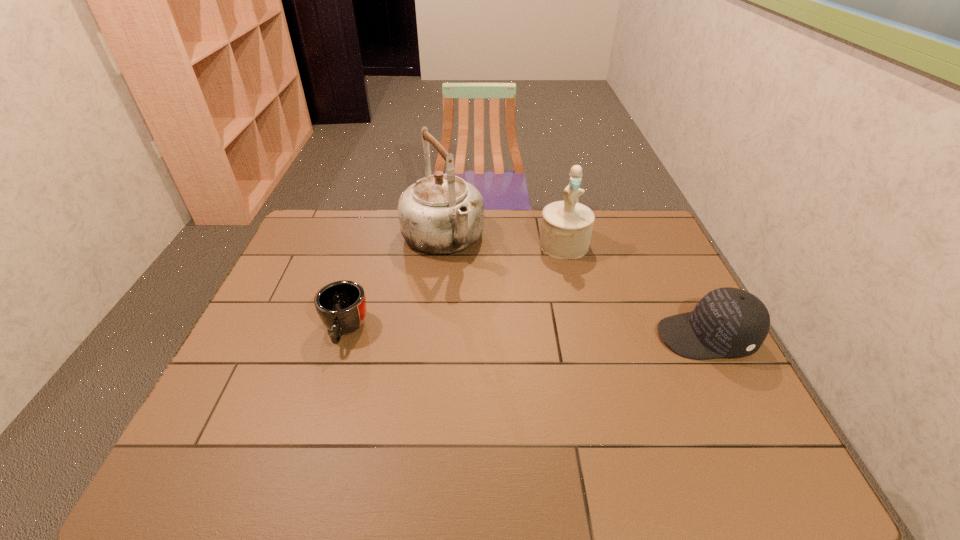
At what (x,y) coordinates should I click in order to perform the action: click on free spot located at the front of the baseball cap where the brim is located. Please return your answer as a coordinate pair (x, y). This screenshot has height=540, width=960. Looking at the image, I should click on tap(595, 337).

What are the coordinates of `vacant space positioned 0.150m at the front of the baseball cap where the brim is located` in the screenshot? It's located at (603, 337).

The height and width of the screenshot is (540, 960). I want to click on free space located at the beak of the third object from left to right, so click(565, 282).

Where is `free space located at the beak of the third object from left to right`? The width and height of the screenshot is (960, 540). free space located at the beak of the third object from left to right is located at coordinates (565, 280).

Locate an element on the screen. Image resolution: width=960 pixels, height=540 pixels. free space located at the beak of the third object from left to right is located at coordinates (565, 288).

Locate an element on the screen. This screenshot has height=540, width=960. vacant region located 0.230m at the spout of the second object from left to right is located at coordinates 490,313.

At what (x,y) coordinates should I click in order to perform the action: click on free spot located at the spout of the second object from left to right. Please return your answer as a coordinate pair (x, y). Looking at the image, I should click on (494, 320).

The height and width of the screenshot is (540, 960). What are the coordinates of `free space located 0.130m at the spout of the second object from left to right` in the screenshot? It's located at (475, 292).

I want to click on figurine that is at the far edge, so click(x=566, y=228).

Where is `kettle that is at the far edge`? kettle that is at the far edge is located at coordinates (440, 214).